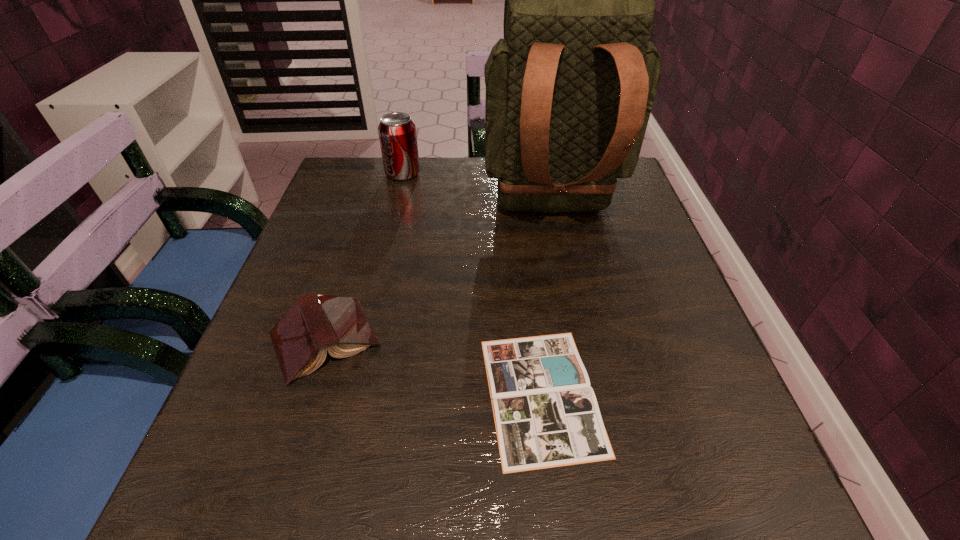
The height and width of the screenshot is (540, 960). I want to click on free space between the backpack and the left book, so click(x=439, y=275).

At what (x,y) coordinates should I click in order to perform the action: click on vacant space that is in between the third tallest object and the tallest object. Please return your answer as a coordinate pair (x, y). The height and width of the screenshot is (540, 960). Looking at the image, I should click on (439, 275).

Find the location of `vacant space that is in between the third shortest object and the third tallest object`. vacant space that is in between the third shortest object and the third tallest object is located at coordinates (364, 256).

I want to click on blank region between the second shortest object and the backpack, so click(439, 275).

At what (x,y) coordinates should I click in order to perform the action: click on free area in between the left book and the backpack. Please return your answer as a coordinate pair (x, y). Image resolution: width=960 pixels, height=540 pixels. Looking at the image, I should click on (439, 275).

Identify the location of object that ranks as the second closest to the third shortest object. [x=315, y=323].

Select which object appears as the closest to the shorter book. Please provide its 2D coordinates. Your answer should be formatted as a tuple, i.e. [(x, y)], where the tuple contains the x and y coordinates of a point satisfying the conditions above.

[(315, 323)]

Locate an element on the screen. The width and height of the screenshot is (960, 540). blank space that satisfies the following two spatial constraints: 1. on the back side of the second tallest object; 2. on the left side of the left book is located at coordinates (377, 173).